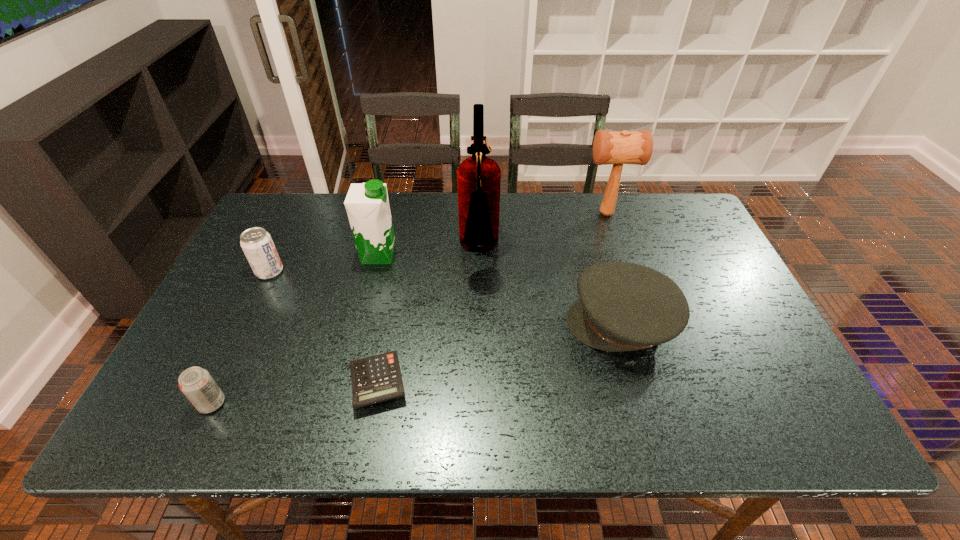
Point out which object is positioned as the third nearest to the soya milk. Please provide its 2D coordinates. Your answer should be formatted as a tuple, i.e. [(x, y)], where the tuple contains the x and y coordinates of a point satisfying the conditions above.

[(377, 378)]

Locate an element on the screen. vacant area that satisfies the following two spatial constraints: 1. on the front-facing side of the shortest object; 2. on the left side of the soya milk is located at coordinates [348, 382].

Find the location of a particular element. free space in the image that satisfies the following two spatial constraints: 1. on the back side of the calculator; 2. on the front-facing side of the third tallest object is located at coordinates (401, 255).

The width and height of the screenshot is (960, 540). Find the location of `free region that satisfies the following two spatial constraints: 1. on the strike surface of the second tallest object; 2. on the front side of the shortest object`. free region that satisfies the following two spatial constraints: 1. on the strike surface of the second tallest object; 2. on the front side of the shortest object is located at coordinates (662, 382).

Where is `vacant space that satisfies the following two spatial constraints: 1. on the front side of the shorter soda can; 2. on the right side of the taller soda can`? vacant space that satisfies the following two spatial constraints: 1. on the front side of the shorter soda can; 2. on the right side of the taller soda can is located at coordinates (206, 403).

Locate an element on the screen. free space that satisfies the following two spatial constraints: 1. on the back side of the sixth tallest object; 2. on the left side of the shortest object is located at coordinates (222, 382).